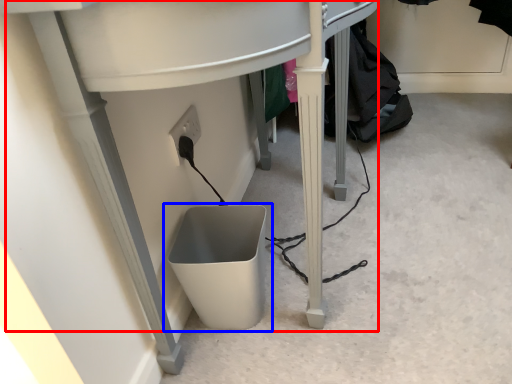
Question: Which point is further to the camera, computer desk (highlighted by a red box) or waste container (highlighted by a blue box)?

Choices:
 (A) computer desk
 (B) waste container

Answer: (B)